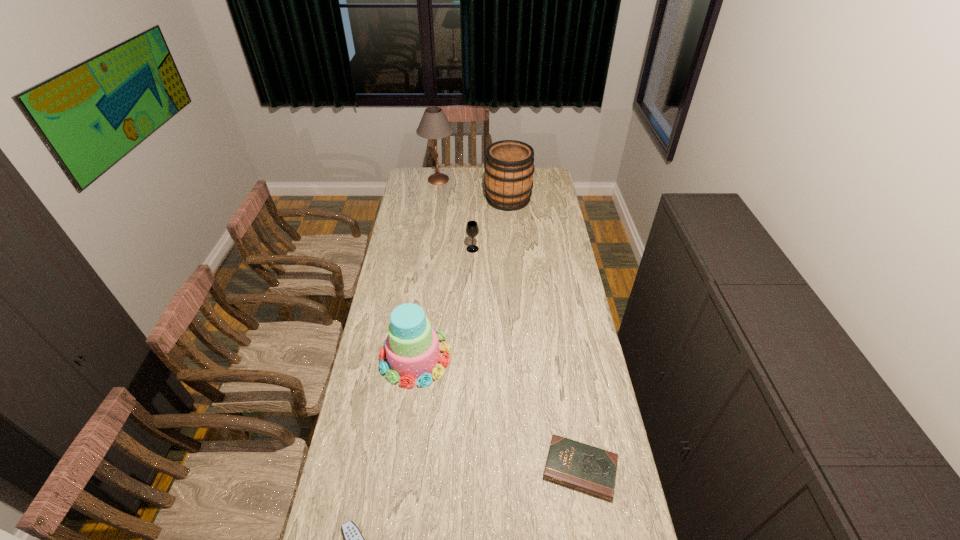
I want to click on free location located on the front of the fourth farthest object, so coord(408,409).

Locate an element on the screen. The height and width of the screenshot is (540, 960). vacant space located on the back of the fourth nearest object is located at coordinates (473, 214).

Find the location of a particular element. free space located on the back of the Bible is located at coordinates (568, 399).

This screenshot has height=540, width=960. I want to click on table lamp present at the far edge, so click(x=434, y=124).

The width and height of the screenshot is (960, 540). Find the location of `cider that is at the far edge`. cider that is at the far edge is located at coordinates (509, 168).

Find the location of `table lamp present at the left edge`. table lamp present at the left edge is located at coordinates (434, 124).

Locate an element on the screen. The width and height of the screenshot is (960, 540). cake that is at the left edge is located at coordinates (412, 350).

Image resolution: width=960 pixels, height=540 pixels. Find the location of `cider situated at the right edge`. cider situated at the right edge is located at coordinates (509, 168).

What are the coordinates of `Bible situated at the right edge` in the screenshot? It's located at (573, 464).

Locate an element on the screen. This screenshot has height=540, width=960. object that is at the far left corner is located at coordinates (434, 124).